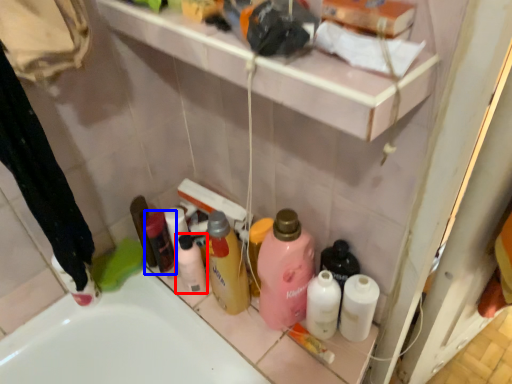
Question: Which point is closer to the camera, toiletry (highlighted by a red box) or toiletry (highlighted by a blue box)?

Choices:
 (A) toiletry
 (B) toiletry

Answer: (A)